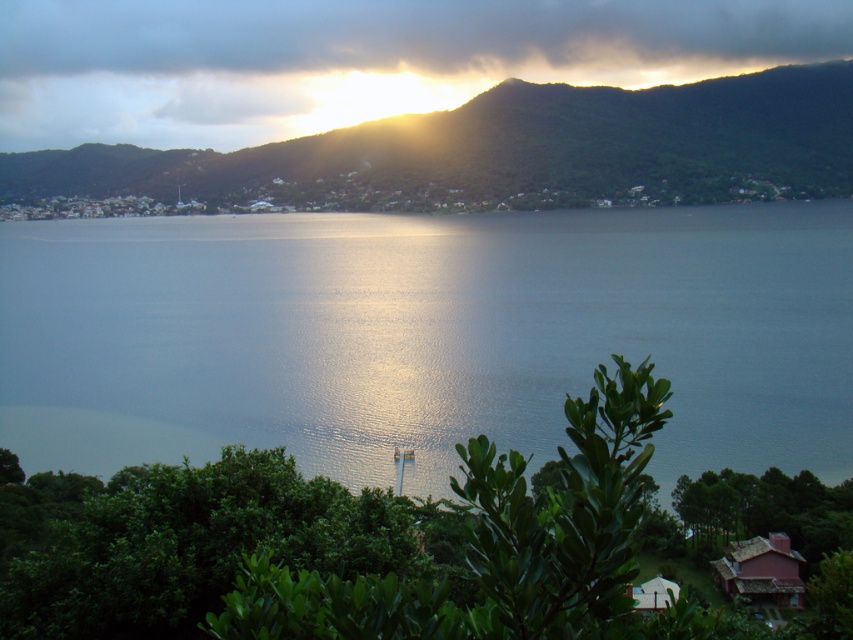
Can you confirm if cloudy sky at upper center is smaller than green leafy mountain at upper center?

Yes.

Who is shorter, cloudy sky at upper center or green leafy mountain at upper center?

cloudy sky at upper center is shorter.

Does point (138, 131) come closer to viewer compared to point (834, 108)?

Yes, it is in front of point (834, 108).

Identify the location of cloudy sky at upper center. The height and width of the screenshot is (640, 853). (357, 58).

Is glistening blue water at center positioned at the back of green leafy mountain at upper center?

No, it is in front of green leafy mountain at upper center.

The height and width of the screenshot is (640, 853). What are the coordinates of `glistening blue water at center` in the screenshot? It's located at (425, 337).

What do you see at coordinates (425, 337) in the screenshot? I see `glistening blue water at center` at bounding box center [425, 337].

Image resolution: width=853 pixels, height=640 pixels. I want to click on glistening blue water at center, so click(425, 337).

In the scene shown: Which is below, glistening blue water at center or cloudy sky at upper center?

glistening blue water at center is below.

Does glistening blue water at center have a larger size compared to cloudy sky at upper center?

Indeed, glistening blue water at center has a larger size compared to cloudy sky at upper center.

Who is more forward, (x=366, y=378) or (x=167, y=4)?

Point (x=366, y=378)

Image resolution: width=853 pixels, height=640 pixels. I want to click on glistening blue water at center, so click(425, 337).